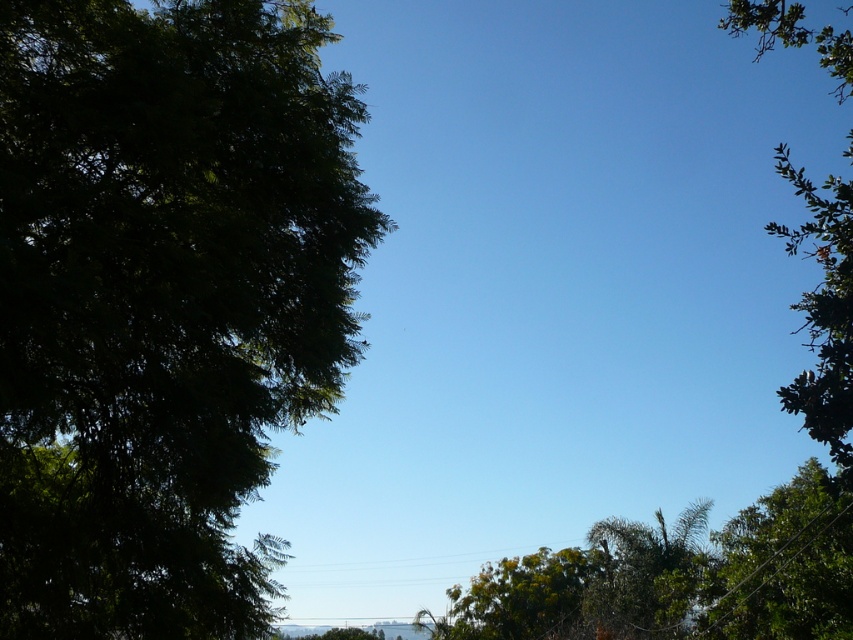
Question: Does green leafy tree at right appear on the right side of green leafy tree at center?

Choices:
 (A) no
 (B) yes

Answer: (B)

Question: Which point is farther to the camera?

Choices:
 (A) green leafy tree at upper right
 (B) green leafy tree at right
 (C) green leafy tree at center

Answer: (C)

Question: Which object is the closest to the green leafy tree at lower right?

Choices:
 (A) green leafy tree at upper right
 (B) green leafy tree at right
 (C) green leafy tree at center
 (D) green leafy tree at left

Answer: (C)

Question: Does green leafy tree at upper right have a smaller size compared to green leafy tree at lower right?

Choices:
 (A) yes
 (B) no

Answer: (B)

Question: Does green leafy tree at lower right have a greater width compared to green leafy tree at center?

Choices:
 (A) yes
 (B) no

Answer: (B)

Question: Which point is closer to the camera?

Choices:
 (A) green leafy tree at lower right
 (B) green leafy tree at left

Answer: (B)